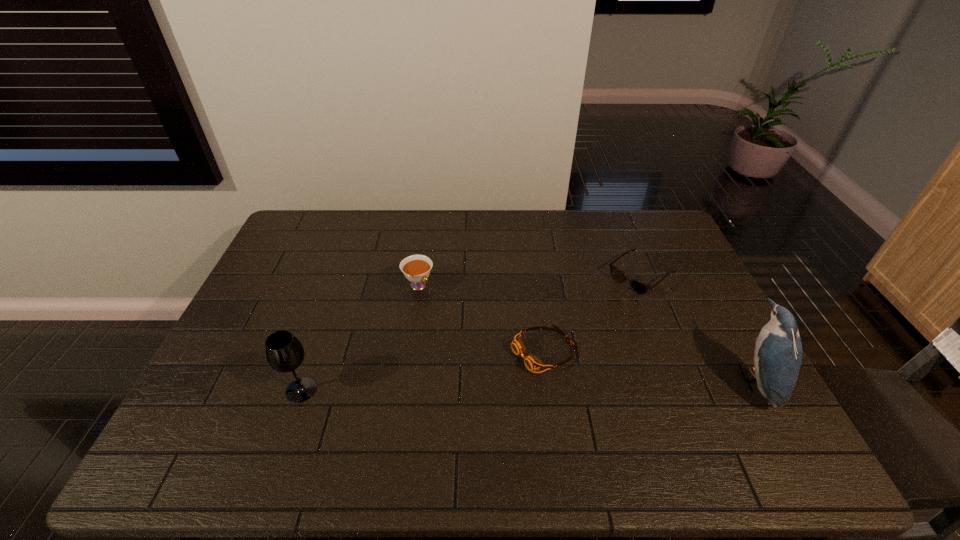
Find the location of a particular element. vacant space located 0.150m with the lenses facing forward on the goggles is located at coordinates (467, 388).

Where is `wineglass that is at the near edge`? wineglass that is at the near edge is located at coordinates (284, 352).

You are a GUI agent. You are given a task and a screenshot of the screen. Output one action in this format:
    pyautogui.click(x=<x>, y=<y>)
    Task: Click on the bird that is at the near edge
    The image size is (960, 540).
    Given the screenshot: What is the action you would take?
    778,349

I want to click on bird located in the right edge section of the desktop, so click(x=778, y=349).

The image size is (960, 540). I want to click on sunglasses present at the right edge, so click(640, 288).

Where is `object that is at the near right corner`? object that is at the near right corner is located at coordinates (778, 349).

Where is `vacant space at the far edge of the desktop`? This screenshot has width=960, height=540. vacant space at the far edge of the desktop is located at coordinates (383, 231).

This screenshot has height=540, width=960. In the image, there is a desktop. Identify the location of blank space at the near edge. (268, 395).

Locate an element on the screen. The height and width of the screenshot is (540, 960). free region at the right edge of the desktop is located at coordinates (714, 360).

Where is `vacant area at the far right corner`? The height and width of the screenshot is (540, 960). vacant area at the far right corner is located at coordinates (677, 243).